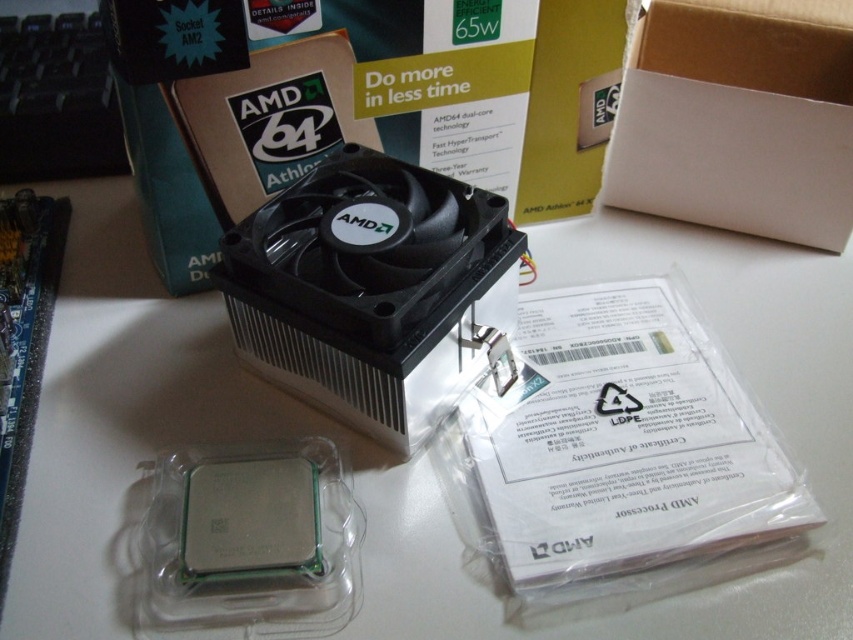
You are organizing a tech store and need to place the black plastic fan at center and the white cardboard box at upper center on a shelf. According to their positions in the image, which item should be placed to the right side of the shelf?

The white cardboard box at upper center should be placed to the right side of the shelf because in the image, the black plastic fan at center is to the left of it.

From the picture: You are a technician who needs to place a black plastic fan at center into a white cardboard box at upper center. The fan is currently 46.51 centimeters away from the box. Can you safely move the fan into the box without it touching any other items?

The distance between the black plastic fan at center and the white cardboard box at upper center is 46.51 centimeters. Since the fan is far enough away from the box, you can safely move it into the box without touching other items.

You are setting up a computer and need to place the black plastic fan at center and the white cardboard box at upper center on a shelf. The shelf has limited space. Which object should you place first to ensure both fit on the shelf?

The black plastic fan at center has a larger width than the white cardboard box at upper center. To ensure both fit on the shelf, place the larger black plastic fan at center first, then the smaller white cardboard box at upper center next to it.